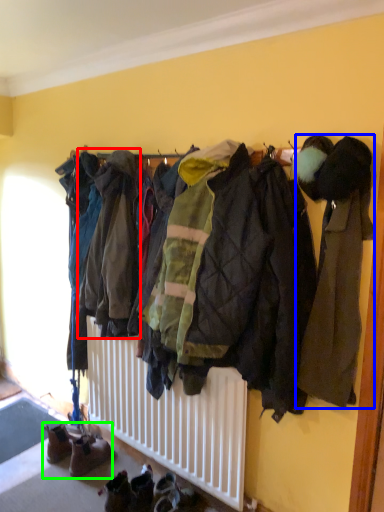
Question: Which object is the farthest from jacket (highlighted by a red box)? Choose among these: jacket (highlighted by a blue box) or footwear (highlighted by a green box).

Choices:
 (A) jacket
 (B) footwear

Answer: (B)